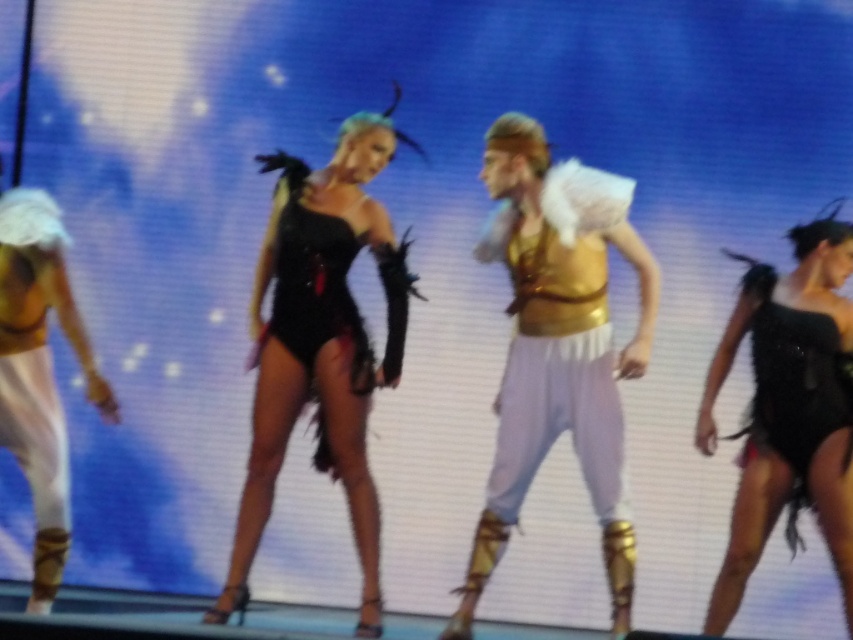
You are a stagehand preparing to place a 1 meter wide prop between the shiny black dress at right and the matte gold bikini top at left. Can the prop fit between them?

The shiny black dress at right might be wider than the matte gold bikini top at left, so the prop may not fit if the space between them is narrower than 1 meter.

You are a stagehand adjusting the lighting for the performance. You need to place a spotlight that can reach both the point at [264,236] and the point at [44,374]. Which point should you focus on first to ensure the spotlight can cover both areas?

You should focus on the point at [264,236] first because it is closer to the camera than the point at [44,374]. By starting with the closer point, you can adjust the spotlight to cover both areas effectively.